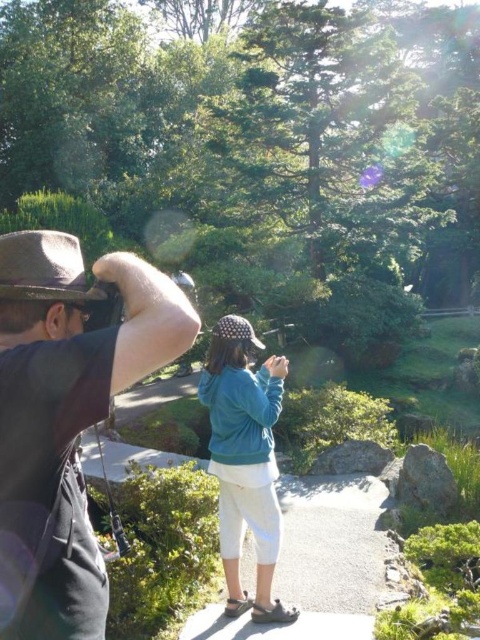
Question: Among these objects, which one is farthest from the camera?

Choices:
 (A) brown fabric hat at upper left
 (B) brown felt cowboy hat at upper left

Answer: (B)

Question: Among these points, which one is nearest to the camera?

Choices:
 (A) (25, 349)
 (B) (24, 230)

Answer: (A)

Question: Observing the image, what is the correct spatial positioning of teal fleece jacket at center in reference to brown felt cowboy hat at upper left?

Choices:
 (A) left
 (B) right

Answer: (B)

Question: Is brown fabric hat at upper left to the left of teal fleece jacket at center from the viewer's perspective?

Choices:
 (A) yes
 (B) no

Answer: (A)

Question: Is brown fabric hat at upper left positioned in front of brown felt cowboy hat at upper left?

Choices:
 (A) yes
 (B) no

Answer: (A)

Question: Which point appears farthest from the camera in this image?

Choices:
 (A) (50, 454)
 (B) (32, 282)
 (C) (240, 356)

Answer: (C)